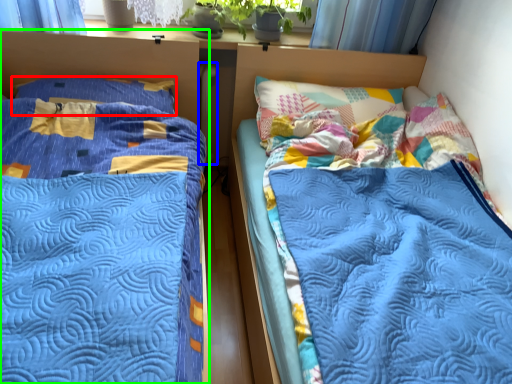
Question: Estimate the real-world distances between objects in this image. Which object is farther from pillow (highlighted by a red box), radiator (highlighted by a blue box) or bed (highlighted by a green box)?

Choices:
 (A) radiator
 (B) bed

Answer: (A)